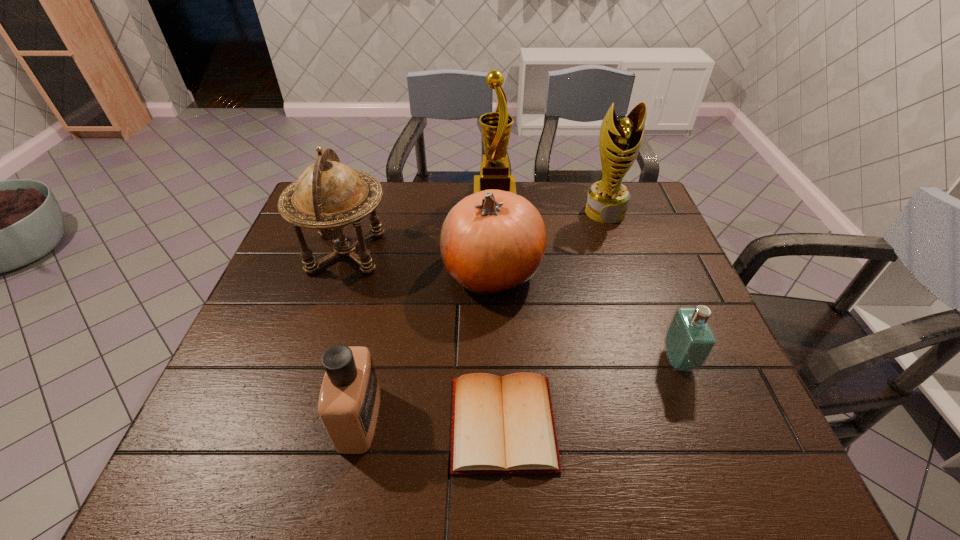
Where is `vacant area that lies between the left award and the right award`? Image resolution: width=960 pixels, height=540 pixels. vacant area that lies between the left award and the right award is located at coordinates (549, 203).

Find the location of `free space that is in between the shortest object and the fourth shortest object`. free space that is in between the shortest object and the fourth shortest object is located at coordinates (497, 347).

I want to click on the fifth closest object to the Bible, so click(x=607, y=200).

Find the location of a particular element. object that is the third closest one to the Bible is located at coordinates (689, 340).

Find the location of a particular element. Image resolution: width=960 pixels, height=540 pixels. free spot that satisfies the following two spatial constraints: 1. on the front-facing side of the left award; 2. on the front side of the shortest object is located at coordinates (504, 423).

Where is `vacant space that satisfies the following two spatial constraints: 1. on the front label of the shortest object; 2. on the left side of the taller perfume`? The height and width of the screenshot is (540, 960). vacant space that satisfies the following two spatial constraints: 1. on the front label of the shortest object; 2. on the left side of the taller perfume is located at coordinates (358, 423).

Find the location of a particular element. vacant point that satisfies the following two spatial constraints: 1. on the front-facing side of the shorter award; 2. on the front-facing side of the globe is located at coordinates (618, 252).

Locate an element on the screen. blank area in the image that satisfies the following two spatial constraints: 1. on the front-facing side of the shortest object; 2. on the left side of the globe is located at coordinates (289, 423).

This screenshot has height=540, width=960. In order to click on vacant space that satisfies the following two spatial constraints: 1. on the front-facing side of the globe; 2. on the left side of the fourth shortest object in this screenshot , I will do `click(340, 271)`.